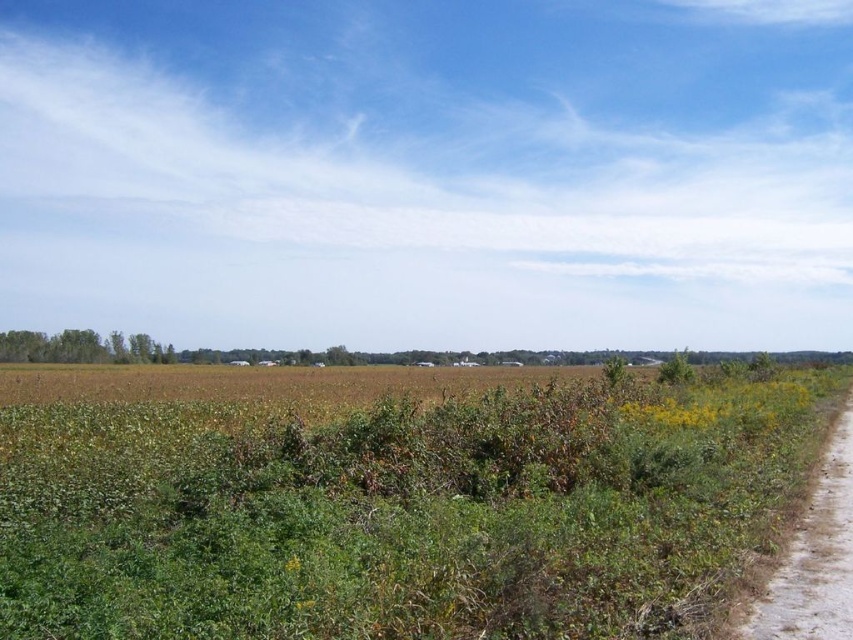
At what (x,y) coordinates should I click in order to perform the action: click on green leafy grass at center. Please return your answer as a coordinate pair (x, y). The width and height of the screenshot is (853, 640). Looking at the image, I should click on (404, 513).

From the picture: Can you confirm if green leafy grass at center is positioned to the right of dirt track at right?

No, green leafy grass at center is not to the right of dirt track at right.

Which is behind, point (378, 609) or point (782, 624)?

Positioned behind is point (782, 624).

At what (x,y) coordinates should I click in order to perform the action: click on green leafy grass at center. Please return your answer as a coordinate pair (x, y). This screenshot has height=640, width=853. Looking at the image, I should click on click(404, 513).